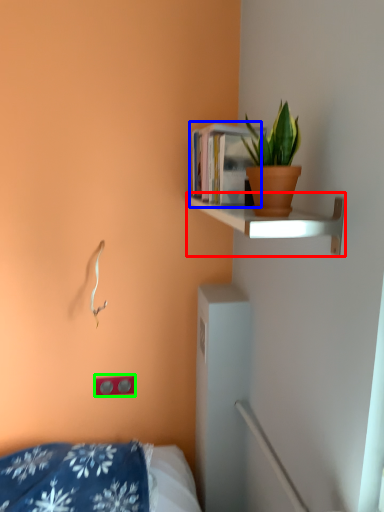
Question: Estimate the real-world distances between objects in this image. Which object is farther from shelf (highlighted by a red box), book (highlighted by a blue box) or electric outlet (highlighted by a green box)?

Choices:
 (A) book
 (B) electric outlet

Answer: (B)